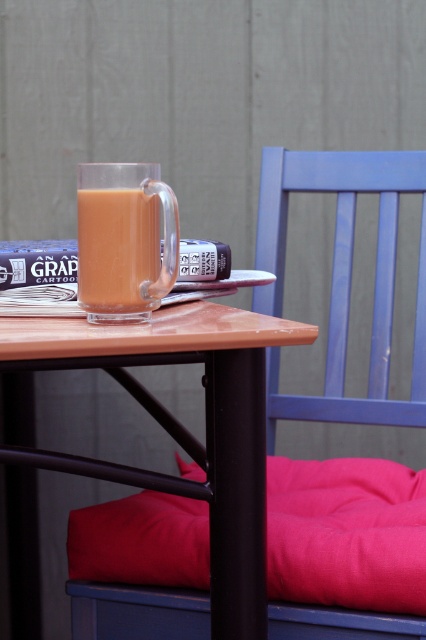
Question: Which of the following is the closest to the observer?

Choices:
 (A) translucent glass mug at upper center
 (B) velvety pink pillow at lower right

Answer: (A)

Question: Among these points, which one is nearest to the camera?

Choices:
 (A) (164, 499)
 (B) (135, 257)

Answer: (B)

Question: Can you confirm if velvety pink pillow at lower right is positioned to the right of matte blue chair at center?

Choices:
 (A) no
 (B) yes

Answer: (A)

Question: Does wooden table at center appear on the right side of translucent glass mug at upper center?

Choices:
 (A) yes
 (B) no

Answer: (A)

Question: Which object is positioned farthest from the matte blue chair at center?

Choices:
 (A) wooden table at center
 (B) velvety pink pillow at lower right
 (C) translucent glass mug at upper center

Answer: (C)

Question: Does wooden table at center come in front of velvety pink pillow at lower right?

Choices:
 (A) yes
 (B) no

Answer: (A)